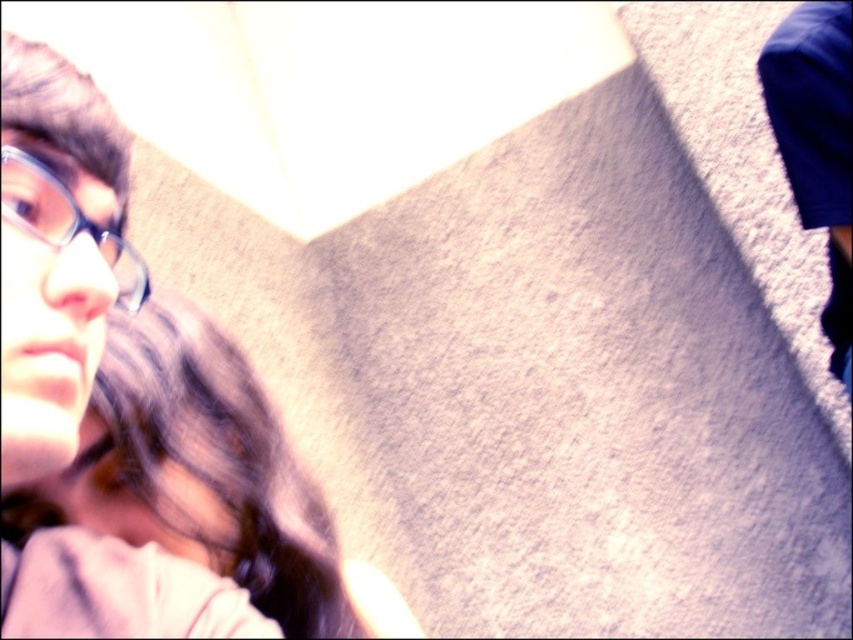
Between smooth skin face at left and matte black glasses at left, which one appears on the right side from the viewer's perspective?

smooth skin face at left

Between smooth skin face at left and matte black glasses at left, which one appears on the left side from the viewer's perspective?

matte black glasses at left is more to the left.

Describe the element at coordinates (204, 477) in the screenshot. I see `smooth skin face at left` at that location.

Locate an element on the screen. The height and width of the screenshot is (640, 853). smooth skin face at left is located at coordinates (204, 477).